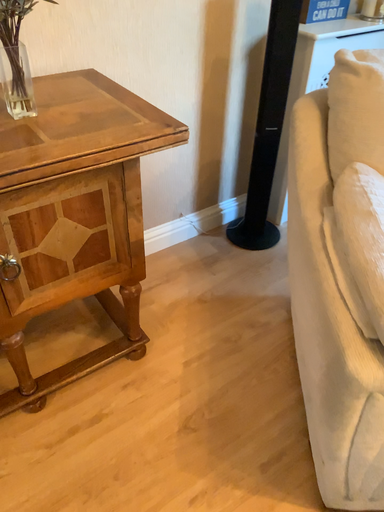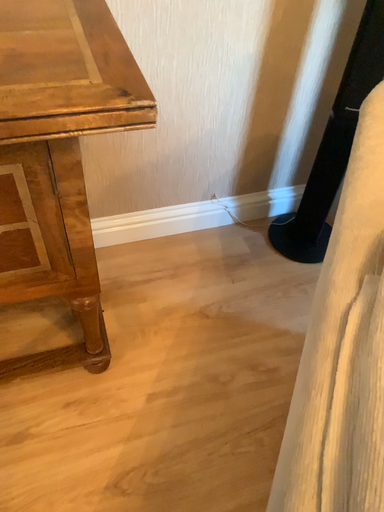
Question: Which way did the camera rotate in the video?

Choices:
 (A) rotated left
 (B) rotated right

Answer: (A)